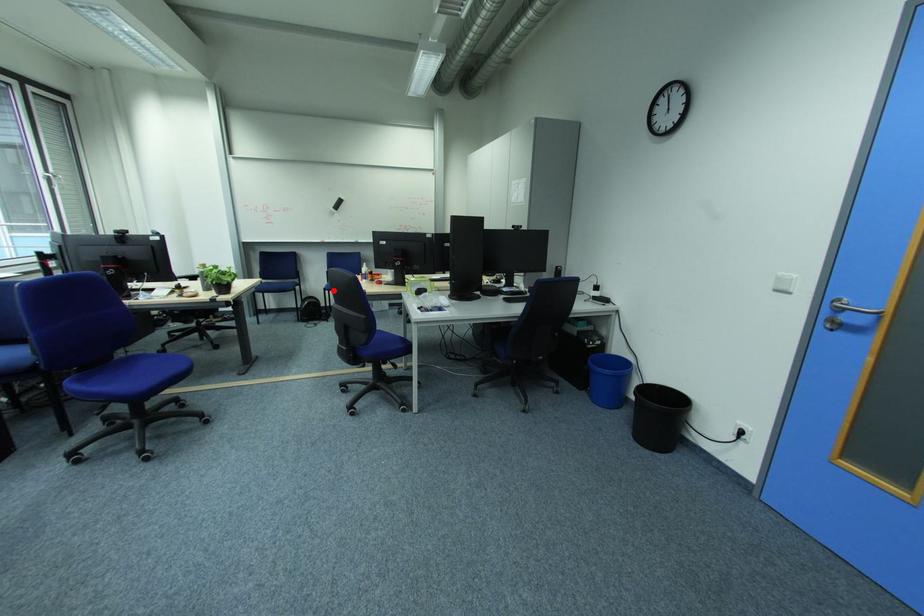
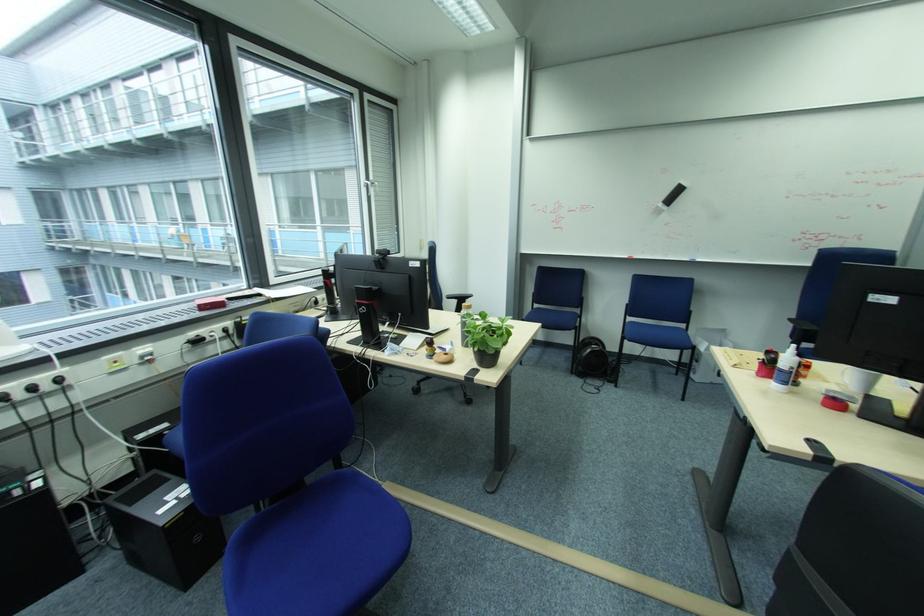
The point at the highlighted location is marked in the first image. Where is the corresponding point in the second image?

(633, 339)